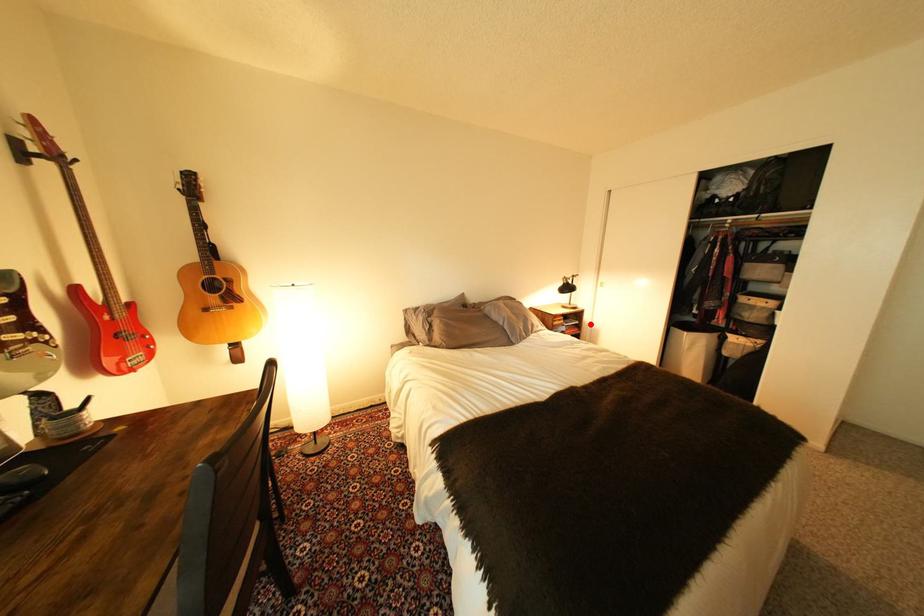
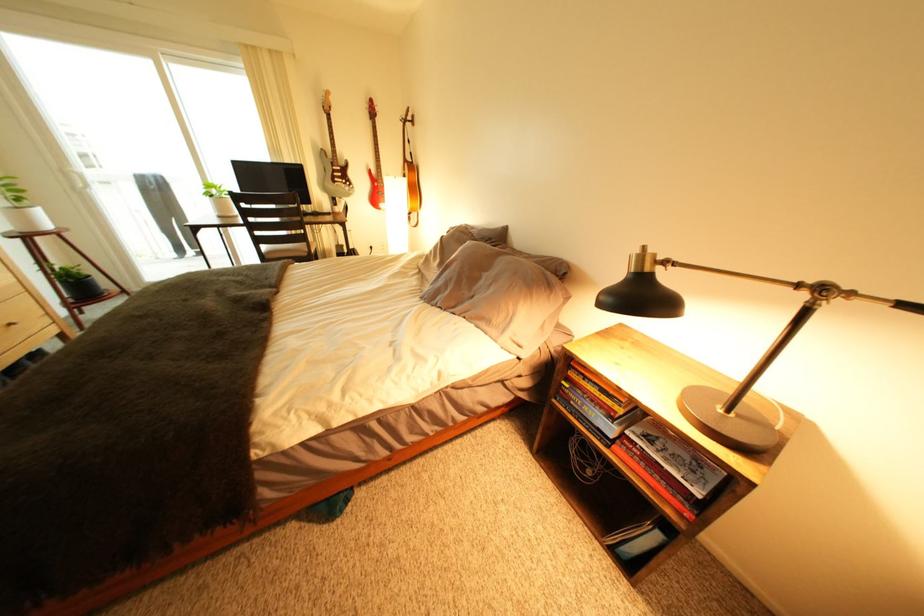
Find the pixel in the second image that matches the highlighted location in the first image.

(712, 496)